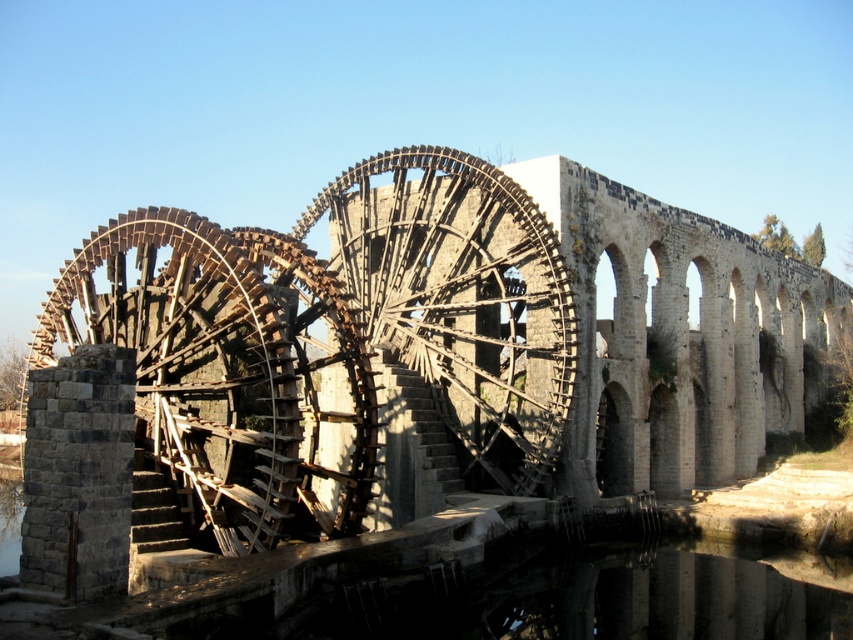
Based on the photo, which is above, wooden waterwheel at left or wooden spokes at center?

wooden spokes at center

Is point (199, 339) closer to viewer compared to point (567, 353)?

Yes.

You are a GUI agent. You are given a task and a screenshot of the screen. Output one action in this format:
    pyautogui.click(x=<x>, y=<y>)
    Task: Click on the wooden waterwheel at left
    Image resolution: width=853 pixels, height=640 pixels.
    Given the screenshot: What is the action you would take?
    pyautogui.click(x=200, y=358)